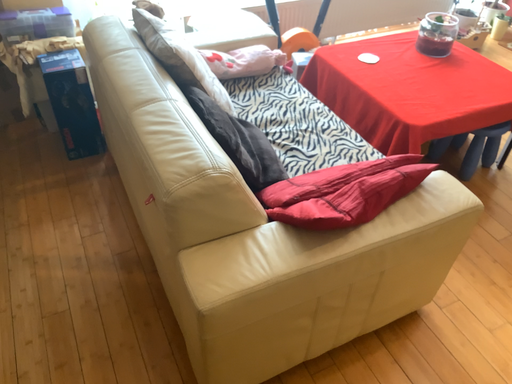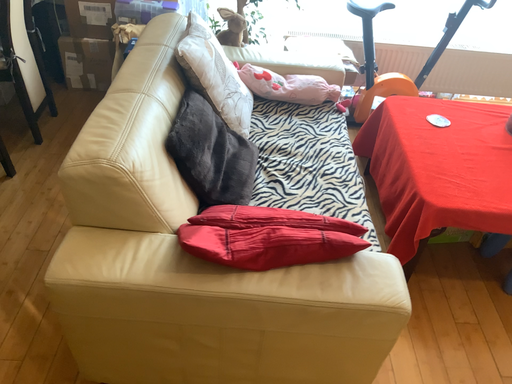
Question: Which way did the camera rotate in the video?

Choices:
 (A) rotated downward
 (B) rotated upward

Answer: (B)